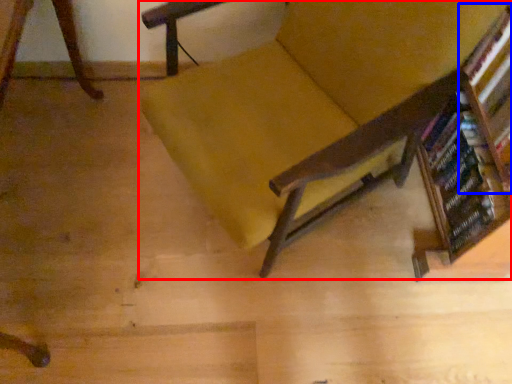
Question: Which point is further to the camera, chair (highlighted by a red box) or shelf (highlighted by a blue box)?

Choices:
 (A) chair
 (B) shelf

Answer: (B)